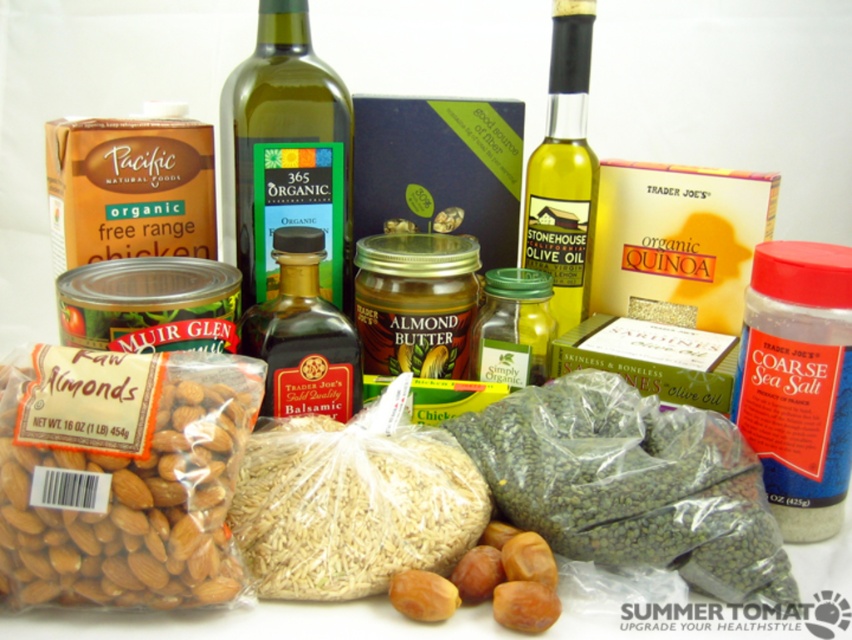
You are setting up a food display and need to place the translucent plastic rice at center and the green glass bottle at center closer together. Currently, they are 12.52 inches apart. If you want them to be 6 inches apart, how much distance do you need to reduce between them?

The current distance between the translucent plastic rice at center and the green glass bottle at center is 12.52 inches. To achieve a 6 inch separation, you need to reduce the distance by 6.52 inches.

You are organizing a pantry and need to place the translucent plastic rice at center and the green glass bottle at center on a shelf. Which item will require more shelf space?

The green glass bottle at center requires more shelf space because it occupies more space than the translucent plastic rice at center according to the description.